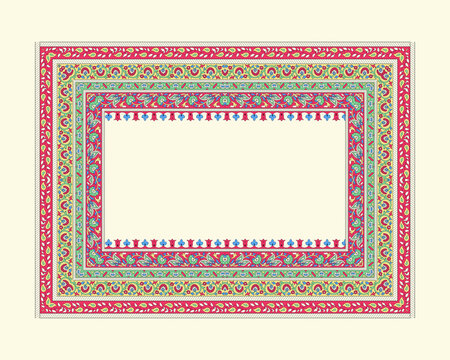
Where is `top right corner of rug`? top right corner of rug is located at coordinates (413, 44).